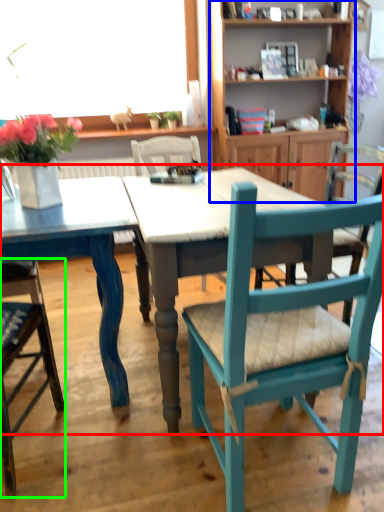
Question: Based on their relative distances, which object is farther from kitchen & dining room table (highlighted by a red box)? Choose from shelf (highlighted by a blue box) and chair (highlighted by a green box).

Choices:
 (A) shelf
 (B) chair

Answer: (A)